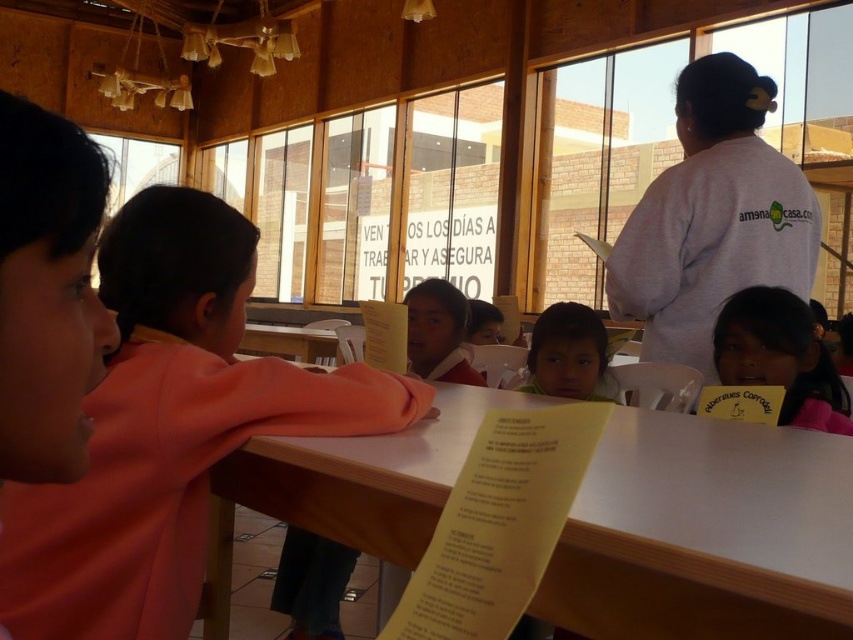
Looking at this image, you are standing in the classroom and want to locate the pink fabric headband at upper right. Which part of the image should you look at?

The pink fabric headband at upper right is located at the upper right part of the image.

Looking at this image, in the classroom scene, there is a smooth skin child at center and a matte pink shirt at center. Which object is located to the left of the other?

The matte pink shirt at center is located to the left of the smooth skin child at center.

You are a teacher in the classroom and want to give a sticker to the child wearing the pink fabric headband at upper right and the matte pink shirt at center. Which child is closer to the ceiling?

The pink fabric headband at upper right is located above the matte pink shirt at center, so the child wearing the pink fabric headband at upper right is closer to the ceiling.